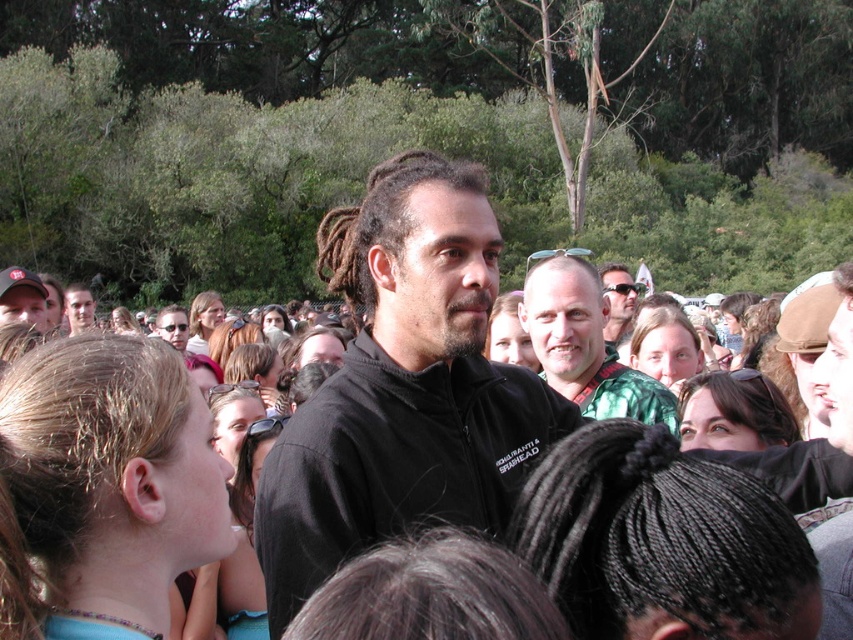
Can you confirm if black matte jacket at center is positioned to the right of matte black jacket at center?

Correct, you'll find black matte jacket at center to the right of matte black jacket at center.

Is black matte jacket at center positioned at the back of matte black jacket at center?

Yes, it is behind matte black jacket at center.

What do you see at coordinates (403, 387) in the screenshot?
I see `black matte jacket at center` at bounding box center [403, 387].

Where is `black matte jacket at center`? black matte jacket at center is located at coordinates (403, 387).

Is black matte jacket at center to the left of matte black sunglasses at center from the viewer's perspective?

Indeed, black matte jacket at center is positioned on the left side of matte black sunglasses at center.

Is black matte jacket at center wider than matte black sunglasses at center?

Yes.

This screenshot has width=853, height=640. I want to click on black matte jacket at center, so (x=403, y=387).

You are a GUI agent. You are given a task and a screenshot of the screen. Output one action in this format:
    pyautogui.click(x=<x>, y=<y>)
    Task: Click on the black matte jacket at center
    The image size is (853, 640).
    Given the screenshot: What is the action you would take?
    pyautogui.click(x=403, y=387)

Who is taller, green textured shirt at center or matte black sunglasses at center?

green textured shirt at center

Which of these two, green textured shirt at center or matte black sunglasses at center, stands shorter?

Standing shorter between the two is matte black sunglasses at center.

Between point (587, 358) and point (602, 284), which one is positioned behind?

Positioned behind is point (602, 284).

Where is `green textured shirt at center`? green textured shirt at center is located at coordinates (585, 346).